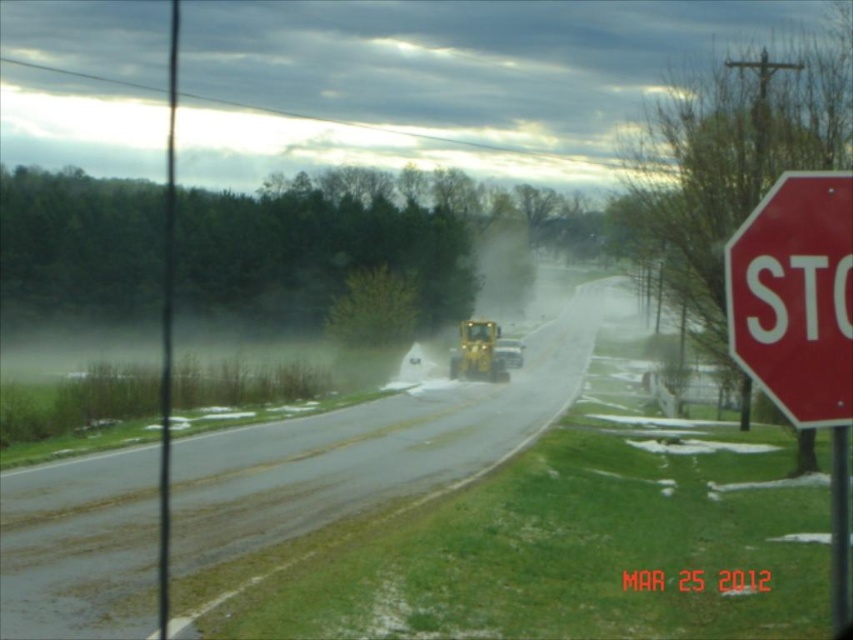
Question: Does red matte stop sign at right appear on the left side of yellow rubber tractor at center?

Choices:
 (A) yes
 (B) no

Answer: (A)

Question: Considering the relative positions of red matte stop sign at right and yellow rubber tractor at center in the image provided, where is red matte stop sign at right located with respect to yellow rubber tractor at center?

Choices:
 (A) right
 (B) left

Answer: (B)

Question: Which object appears farthest from the camera in this image?

Choices:
 (A) yellow rubber tractor at center
 (B) red matte stop sign at right

Answer: (A)

Question: Among these points, which one is farthest from the camera?

Choices:
 (A) (515, 346)
 (B) (793, 344)

Answer: (A)

Question: Does red matte stop sign at right appear on the left side of yellow rubber tractor at center?

Choices:
 (A) no
 (B) yes

Answer: (B)